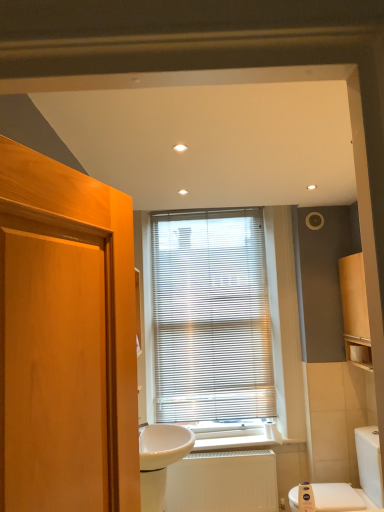
Question: Is white glossy sink at center inside or outside of metallic blinds at center?

Choices:
 (A) outside
 (B) inside

Answer: (A)

Question: From a real-world perspective, is white glossy sink at center physically located above or below metallic blinds at center?

Choices:
 (A) above
 (B) below

Answer: (B)

Question: Considering the real-world distances, which object is farthest from the white glossy toilet at lower right?

Choices:
 (A) matte wood cabinet at right
 (B) white textured radiator at lower center
 (C) white glossy sink at center
 (D) white matte toilet paper at right
 (E) metallic blinds at center

Answer: (E)

Question: Which of these objects is positioned farthest from the white matte toilet paper at right?

Choices:
 (A) white glossy toilet at lower right
 (B) matte wood cabinet at right
 (C) metallic blinds at center
 (D) white textured radiator at lower center
 (E) white glossy sink at center

Answer: (E)